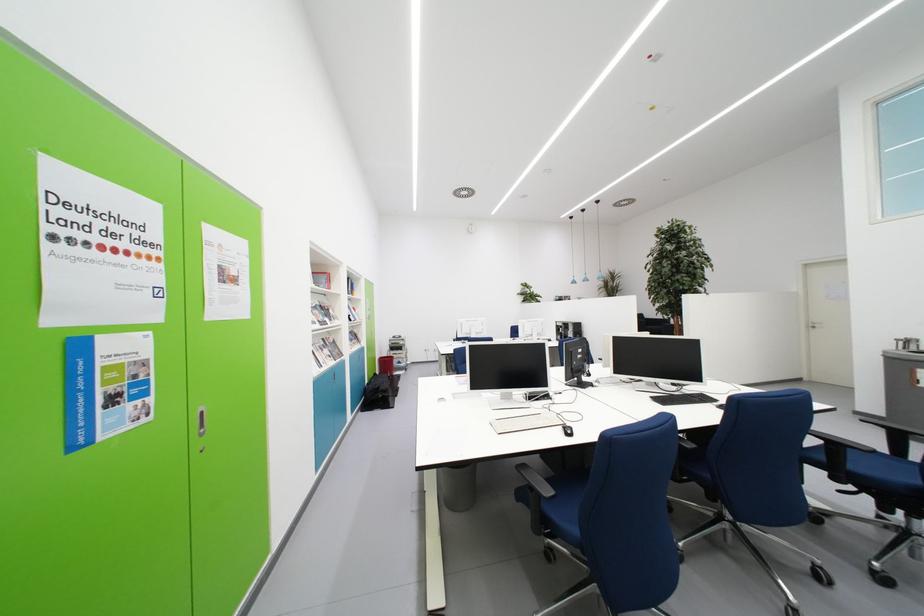
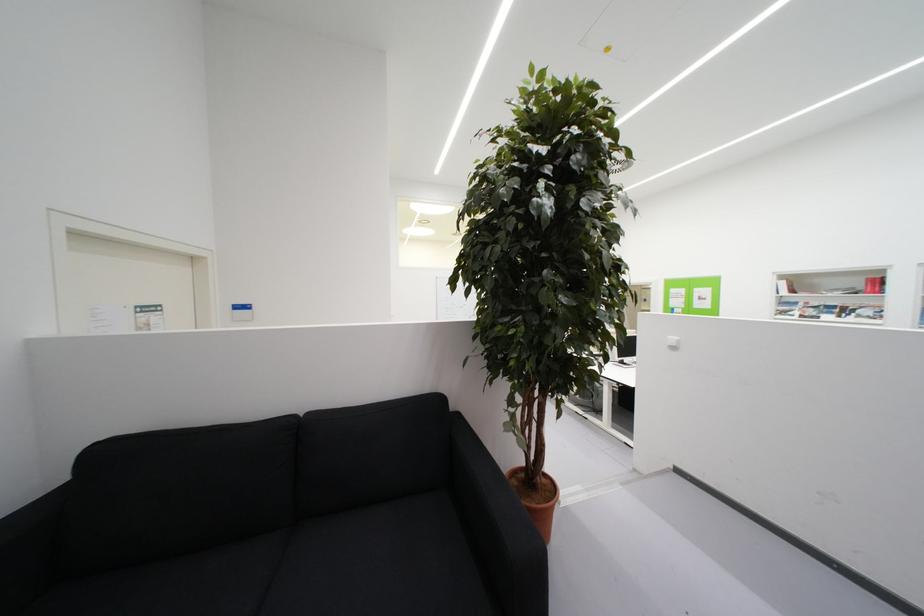
Question: I am providing you with two images of the same scene from different viewpoints. Please identify which objects are invisible in image2.

Choices:
 (A) black sofa armrest
 (B) gold weight plate
 (C) black chair armrest
 (D) brown plant pot

Answer: (C)